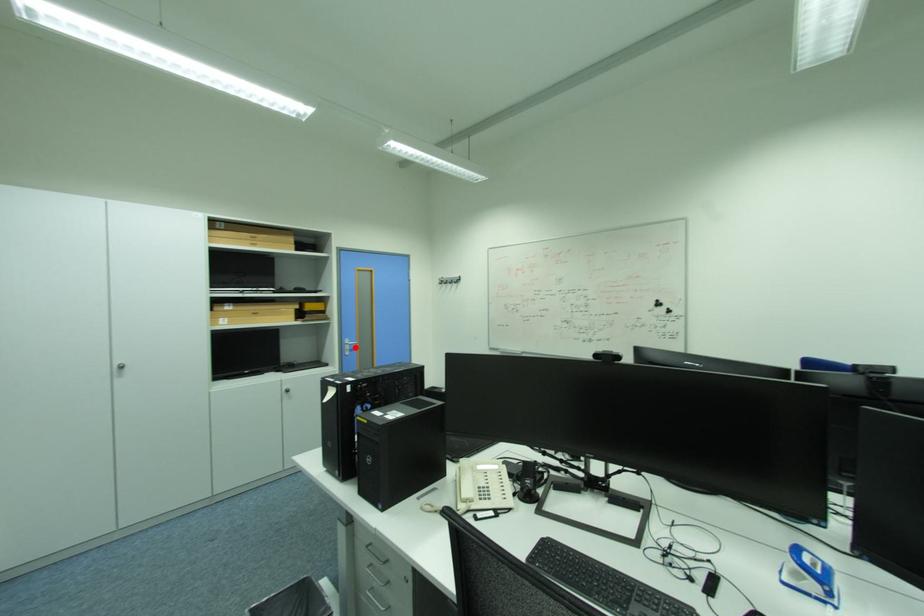
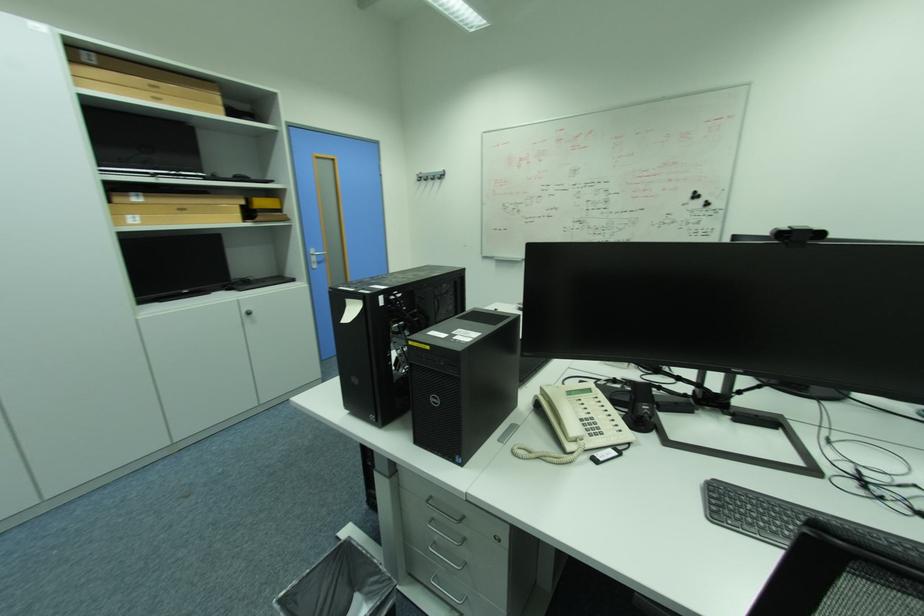
Question: I am providing you with two images of the same scene from different viewpoints. Image1 has a red point marked. In image2, the corresponding 3D location appears at what relative position? Reply with the corresponding letter.

Choices:
 (A) Closer
 (B) Farther

Answer: (B)